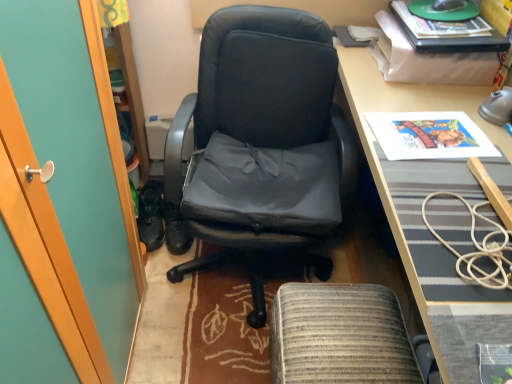
Where is `vacant space in front of black plastic mouse at upper right`? The image size is (512, 384). vacant space in front of black plastic mouse at upper right is located at coordinates (447, 47).